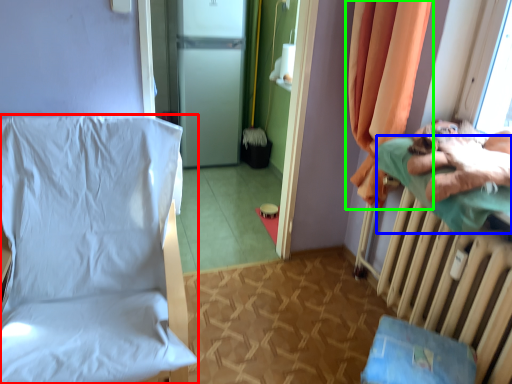
Question: Based on their relative distances, which object is nearer to furniture (highlighted by a red box)? Choose from pillow (highlighted by a blue box) and curtain (highlighted by a green box).

Choices:
 (A) pillow
 (B) curtain

Answer: (B)